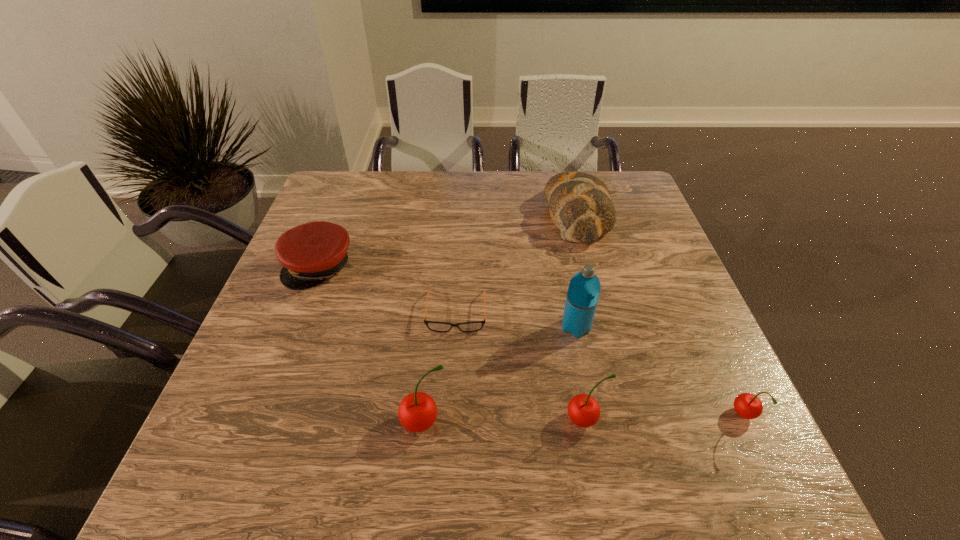
This screenshot has width=960, height=540. I want to click on vacant space that satisfies the following two spatial constraints: 1. on the back side of the bread; 2. on the left side of the leftmost cherry, so click(x=444, y=215).

The width and height of the screenshot is (960, 540). In order to click on vacant region that satisfies the following two spatial constraints: 1. on the front-facing side of the cap; 2. on the left side of the rightmost object in this screenshot , I will do `click(261, 416)`.

At what (x,y) coordinates should I click in order to perform the action: click on free region that satisfies the following two spatial constraints: 1. on the front side of the bread; 2. on the left side of the rightmost object. Please return your answer as a coordinate pair (x, y). The image size is (960, 540). Looking at the image, I should click on (630, 416).